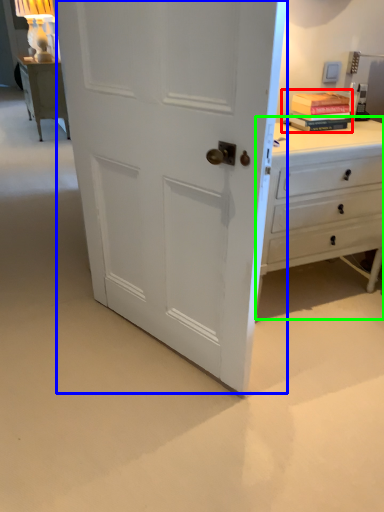
Question: Estimate the real-world distances between objects in this image. Which object is closer to book (highlighted by a red box), door (highlighted by a blue box) or chest of drawers (highlighted by a green box)?

Choices:
 (A) door
 (B) chest of drawers

Answer: (B)